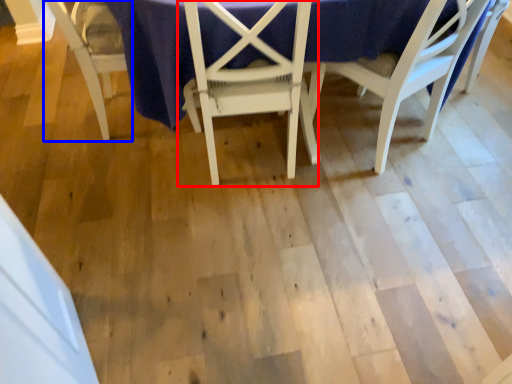
Question: Which point is closer to the camera, chair (highlighted by a red box) or chair (highlighted by a blue box)?

Choices:
 (A) chair
 (B) chair

Answer: (A)